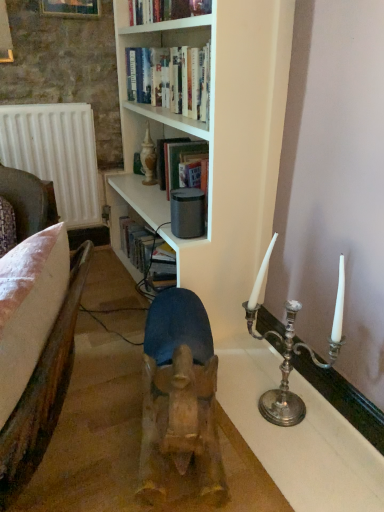
Question: Is brown leather armchair at left closer to camera compared to wooden frame at upper left?

Choices:
 (A) no
 (B) yes

Answer: (B)

Question: From the image's perspective, is brown leather armchair at left above wooden frame at upper left?

Choices:
 (A) yes
 (B) no

Answer: (B)

Question: Could you tell me if brown leather armchair at left is facing wooden frame at upper left?

Choices:
 (A) no
 (B) yes

Answer: (A)

Question: Is brown leather armchair at left thinner than wooden frame at upper left?

Choices:
 (A) yes
 (B) no

Answer: (B)

Question: Can you confirm if brown leather armchair at left is taller than wooden frame at upper left?

Choices:
 (A) yes
 (B) no

Answer: (A)

Question: In terms of size, does hardcover book at upper center appear bigger or smaller than wooden frame at upper left?

Choices:
 (A) small
 (B) big

Answer: (B)

Question: Which is correct: hardcover book at upper center is inside wooden frame at upper left, or outside of it?

Choices:
 (A) outside
 (B) inside

Answer: (A)

Question: Is hardcover book at upper center wider or thinner than wooden frame at upper left?

Choices:
 (A) thin
 (B) wide

Answer: (B)

Question: From a real-world perspective, is hardcover book at upper center positioned above or below wooden frame at upper left?

Choices:
 (A) above
 (B) below

Answer: (B)

Question: Relative to hardcover book at upper center, is wooden frame at upper left in front or behind?

Choices:
 (A) behind
 (B) front

Answer: (A)

Question: Is wooden frame at upper left to the left or to the right of hardcover book at upper center in the image?

Choices:
 (A) right
 (B) left

Answer: (B)

Question: From the image's perspective, is wooden frame at upper left located above or below hardcover book at upper center?

Choices:
 (A) below
 (B) above

Answer: (B)

Question: Does point (74, 12) appear closer or farther from the camera than point (145, 9)?

Choices:
 (A) farther
 (B) closer

Answer: (A)

Question: Is white matte radiator at left inside the boundaries of brown leather armchair at left, or outside?

Choices:
 (A) inside
 (B) outside

Answer: (B)

Question: Considering the relative positions of white matte radiator at left and brown leather armchair at left in the image provided, is white matte radiator at left to the left or to the right of brown leather armchair at left?

Choices:
 (A) left
 (B) right

Answer: (A)